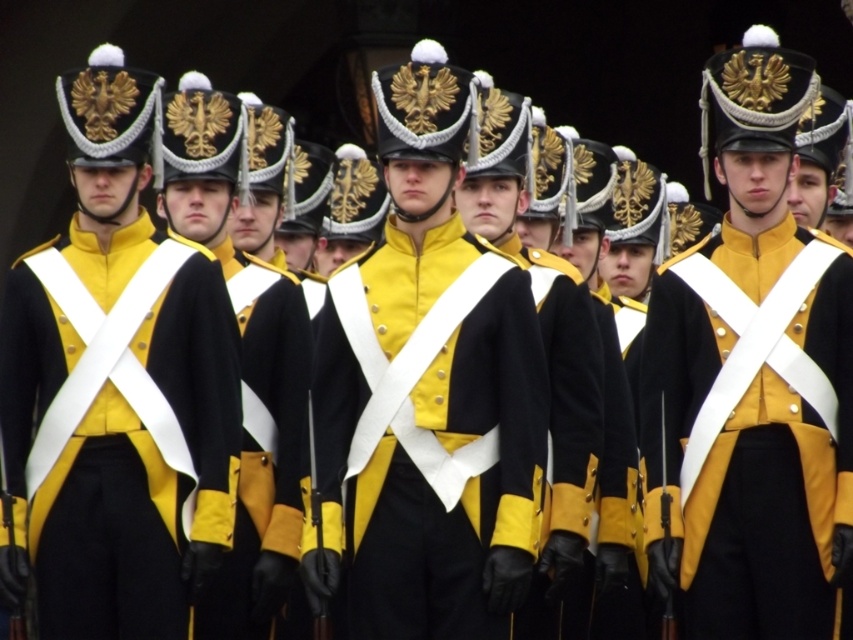
You are a photographer trying to capture a clear shot of the yellow matte uniform at center from your current position. Considering the distance, will the uniform be in focus if your camera has a maximum focusing range of 60 meters?

The yellow matte uniform at center is 68.27 meters from the camera, which exceeds the maximum focusing range of 60 meters. Therefore, the uniform will not be in focus.

You are a photographer positioned at the origin point. You need to capture a closeup of the black matte uniform at center. According to the coordinates provided, in which direction should you move your camera to focus on the uniform?

The black matte uniform at center is located at point 0.673 on the x axis and 0.503 on the y axis. Since the origin is at the bottom left corner, moving the camera to the right along the x axis and slightly up along the y axis will center the uniform in the frame.

You are a photographer positioned at the front of the formation. You need to capture a clear photo of both the black matte uniform at center and the black wool coat at center. Which one will appear closer to you in the photo?

The black matte uniform at center will appear closer to you in the photo because it is positioned in front of the black wool coat at center.